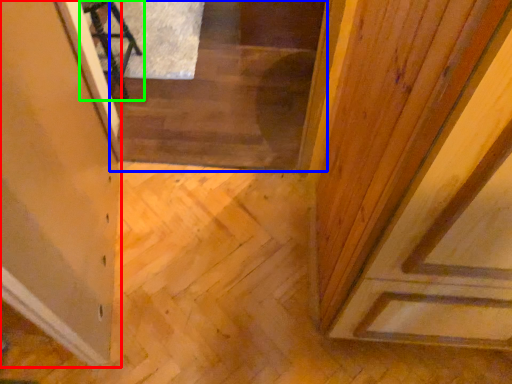
Question: Which is nearer to the glass door (highlighted by a red box)? stairwell (highlighted by a blue box) or furniture (highlighted by a green box).

Choices:
 (A) stairwell
 (B) furniture

Answer: (A)